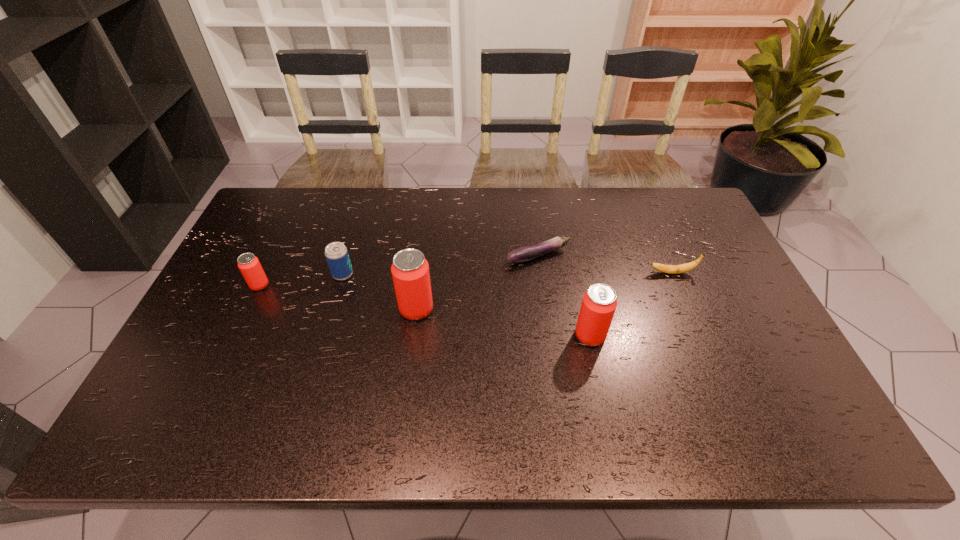
Where is `the leftmost object`? the leftmost object is located at coordinates [x=249, y=265].

The height and width of the screenshot is (540, 960). In order to click on the second beer can from right to left in this screenshot , I will do `click(410, 270)`.

At what (x,y) coordinates should I click in order to perform the action: click on the second nearest object. Please return your answer as a coordinate pair (x, y). This screenshot has width=960, height=540. Looking at the image, I should click on (410, 270).

Find the location of a particular element. the rightmost beer can is located at coordinates (599, 303).

At what (x,y) coordinates should I click in order to perform the action: click on the nearest beer can. Please return your answer as a coordinate pair (x, y). The image size is (960, 540). Looking at the image, I should click on (599, 303).

Where is `eggplant`? This screenshot has height=540, width=960. eggplant is located at coordinates (527, 253).

I want to click on banana, so click(x=669, y=269).

The image size is (960, 540). In order to click on the fifth tallest object in this screenshot , I will do `click(669, 269)`.

Locate an element on the screen. The image size is (960, 540). the second beer can from left to right is located at coordinates (336, 253).

Where is `free location located 0.170m on the back of the leftmost object`? free location located 0.170m on the back of the leftmost object is located at coordinates (281, 241).